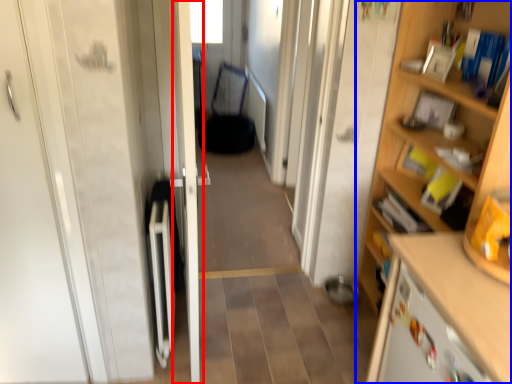
Question: Which object appears closest to the camera in this image, door (highlighted by a red box) or cupboard (highlighted by a blue box)?

Choices:
 (A) door
 (B) cupboard

Answer: (B)